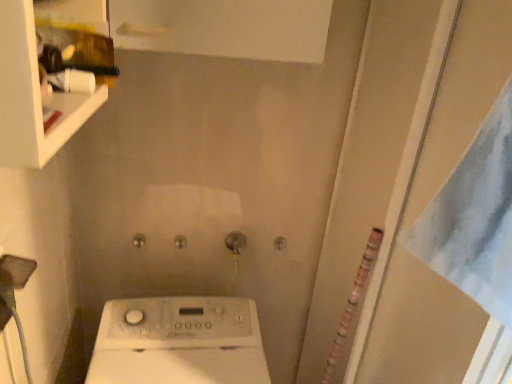
The image size is (512, 384). What are the coordinates of `transparent plastic screen door at right` in the screenshot? It's located at (431, 198).

The height and width of the screenshot is (384, 512). Describe the element at coordinates (431, 198) in the screenshot. I see `transparent plastic screen door at right` at that location.

Describe the element at coordinates (42, 72) in the screenshot. The height and width of the screenshot is (384, 512). I see `white glossy shelf at upper left` at that location.

Locate an element on the screen. The image size is (512, 384). white glossy shelf at upper left is located at coordinates (42, 72).

At what (x,y) coordinates should I click in order to perform the action: click on transparent plastic screen door at right. Please return your answer as a coordinate pair (x, y). The width and height of the screenshot is (512, 384). Looking at the image, I should click on (431, 198).

Is white glossy shelf at upper left to the left of transparent plastic screen door at right from the viewer's perspective?

Yes, white glossy shelf at upper left is to the left of transparent plastic screen door at right.

In the image, is white glossy shelf at upper left positioned in front of or behind transparent plastic screen door at right?

Visually, white glossy shelf at upper left is located in front of transparent plastic screen door at right.

Does point (27, 130) come behind point (392, 353)?

No, (27, 130) is in front of (392, 353).

From the image's perspective, which is above, white glossy shelf at upper left or transparent plastic screen door at right?

white glossy shelf at upper left appears higher in the image.

From a real-world perspective, is white glossy shelf at upper left positioned above or below transparent plastic screen door at right?

In terms of real-world spatial position, white glossy shelf at upper left is above transparent plastic screen door at right.

Looking at their sizes, would you say white glossy shelf at upper left is wider or thinner than transparent plastic screen door at right?

white glossy shelf at upper left is wider than transparent plastic screen door at right.

Who is shorter, white glossy shelf at upper left or transparent plastic screen door at right?

white glossy shelf at upper left is shorter.

Considering the relative sizes of white glossy shelf at upper left and transparent plastic screen door at right in the image provided, is white glossy shelf at upper left smaller than transparent plastic screen door at right?

Indeed, white glossy shelf at upper left has a smaller size compared to transparent plastic screen door at right.

Is transparent plastic screen door at right inside white glossy shelf at upper left?

No.

Is the surface of white glossy shelf at upper left in direct contact with transparent plastic screen door at right?

No, white glossy shelf at upper left is not touching transparent plastic screen door at right.

Is white glossy shelf at upper left turned away from transparent plastic screen door at right?

No, white glossy shelf at upper left is not facing the opposite direction of transparent plastic screen door at right.

Find the location of `screen door that is on the right side of white glossy shelf at upper left`. screen door that is on the right side of white glossy shelf at upper left is located at coordinates (431, 198).

Considering the positions of objects transparent plastic screen door at right and white glossy shelf at upper left in the image provided, who is more to the right, transparent plastic screen door at right or white glossy shelf at upper left?

transparent plastic screen door at right is more to the right.

Which is behind, transparent plastic screen door at right or white glossy shelf at upper left?

transparent plastic screen door at right is more distant.

Considering the positions of points (463, 7) and (72, 2), is point (463, 7) closer to camera compared to point (72, 2)?

No, (463, 7) is further to viewer.

Based on the photo, from the image's perspective, is transparent plastic screen door at right under white glossy shelf at upper left?

Yes.

From a real-world perspective, is transparent plastic screen door at right physically below white glossy shelf at upper left?

Yes, from a real-world perspective, transparent plastic screen door at right is beneath white glossy shelf at upper left.

Considering the sizes of objects transparent plastic screen door at right and white glossy shelf at upper left in the image provided, who is wider, transparent plastic screen door at right or white glossy shelf at upper left?

white glossy shelf at upper left is wider.

Considering the relative sizes of transparent plastic screen door at right and white glossy shelf at upper left in the image provided, is transparent plastic screen door at right shorter than white glossy shelf at upper left?

No.

Based on their sizes in the image, would you say transparent plastic screen door at right is bigger or smaller than white glossy shelf at upper left?

Considering their sizes, transparent plastic screen door at right takes up more space than white glossy shelf at upper left.

Is transparent plastic screen door at right inside or outside of white glossy shelf at upper left?

transparent plastic screen door at right is not enclosed by white glossy shelf at upper left.

Is transparent plastic screen door at right not near white glossy shelf at upper left?

No, transparent plastic screen door at right is not far away from white glossy shelf at upper left.

Does transparent plastic screen door at right turn towards white glossy shelf at upper left?

Yes, transparent plastic screen door at right is aimed at white glossy shelf at upper left.

Locate an element on the screen. screen door behind the white glossy shelf at upper left is located at coordinates (431, 198).

Where is `shelf in front of the transparent plastic screen door at right`? This screenshot has height=384, width=512. shelf in front of the transparent plastic screen door at right is located at coordinates (42, 72).

Where is `screen door behind the white glossy shelf at upper left`? This screenshot has width=512, height=384. screen door behind the white glossy shelf at upper left is located at coordinates (431, 198).